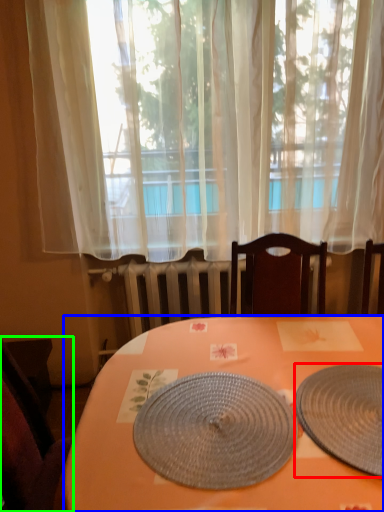
Question: Estimate the real-world distances between objects in this image. Which object is farther from plate (highlighted by a red box), desk (highlighted by a blue box) or chair (highlighted by a green box)?

Choices:
 (A) desk
 (B) chair

Answer: (B)